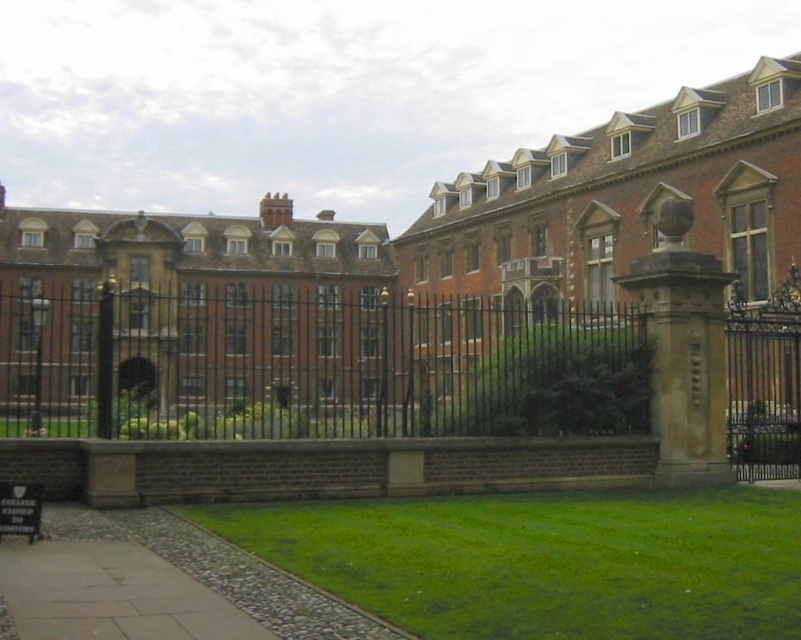
Can you confirm if brick building at center is positioned to the right of green grass at lower center?

In fact, brick building at center is to the left of green grass at lower center.

Between point (115, 353) and point (506, 628), which one is positioned behind?

The point (115, 353) is more distant.

Between point (622, 128) and point (618, 621), which one is positioned in front?

Point (618, 621)

You are a GUI agent. You are given a task and a screenshot of the screen. Output one action in this format:
    pyautogui.click(x=<x>, y=<y>)
    Task: Click on the brick building at center
    Image resolution: width=801 pixels, height=640 pixels.
    Given the screenshot: What is the action you would take?
    pyautogui.click(x=413, y=292)

Can you confirm if brick building at center is thinner than black wrought iron fence at center?

No, brick building at center is not thinner than black wrought iron fence at center.

Is point (147, 380) closer to camera compared to point (306, 336)?

Yes.

Identify the location of brick building at center. This screenshot has width=801, height=640. (413, 292).

Between black wrought iron fence at center and green grass at lower center, which one appears on the left side from the viewer's perspective?

Positioned to the left is black wrought iron fence at center.

Which of these two, black wrought iron fence at center or green grass at lower center, stands shorter?

green grass at lower center

Locate an element on the screen. black wrought iron fence at center is located at coordinates (314, 368).

Where is `black wrought iron fence at center`? black wrought iron fence at center is located at coordinates (314, 368).